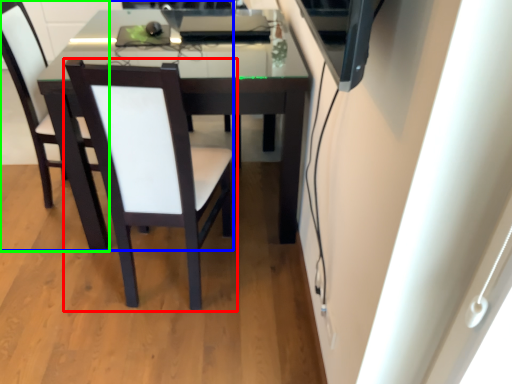
Question: Which object is positioned farthest from chair (highlighted by a red box)? Select from chair (highlighted by a blue box) and chair (highlighted by a green box).

Choices:
 (A) chair
 (B) chair

Answer: (B)